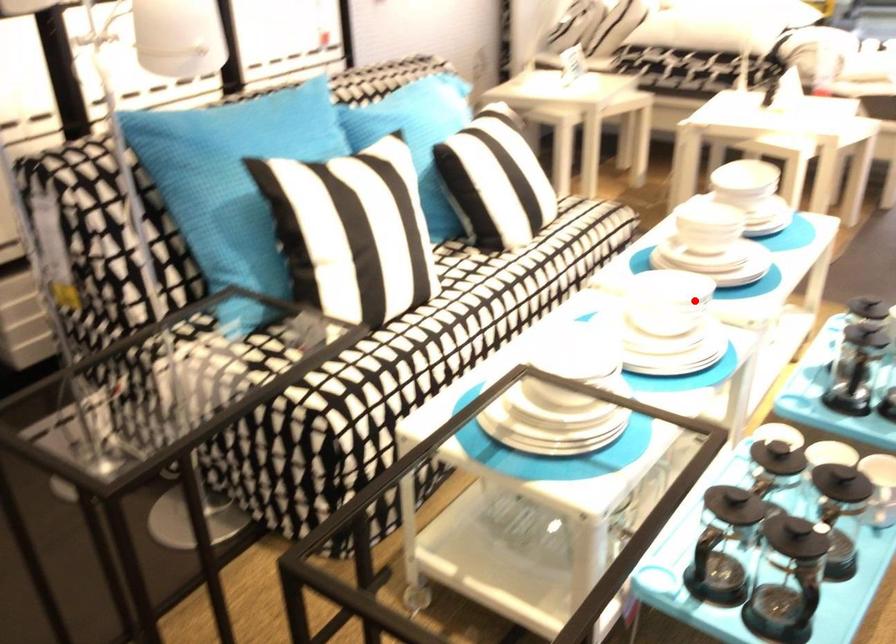
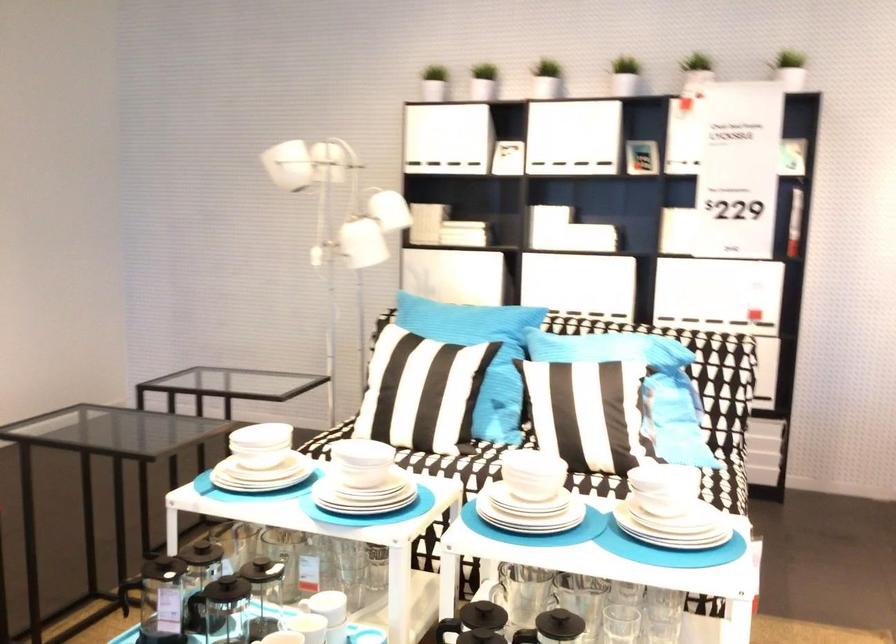
Question: I am providing you with two images of the same scene from different viewpoints. Given a red point in image1, look at the same physical point in image2. Is it:

Choices:
 (A) Closer to the viewpoint
 (B) Farther from the viewpoint

Answer: (B)